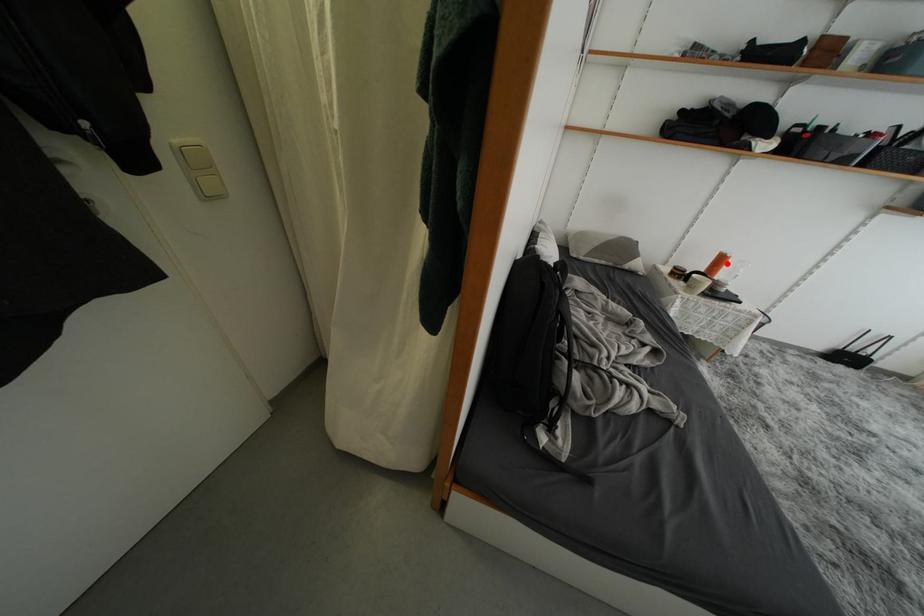
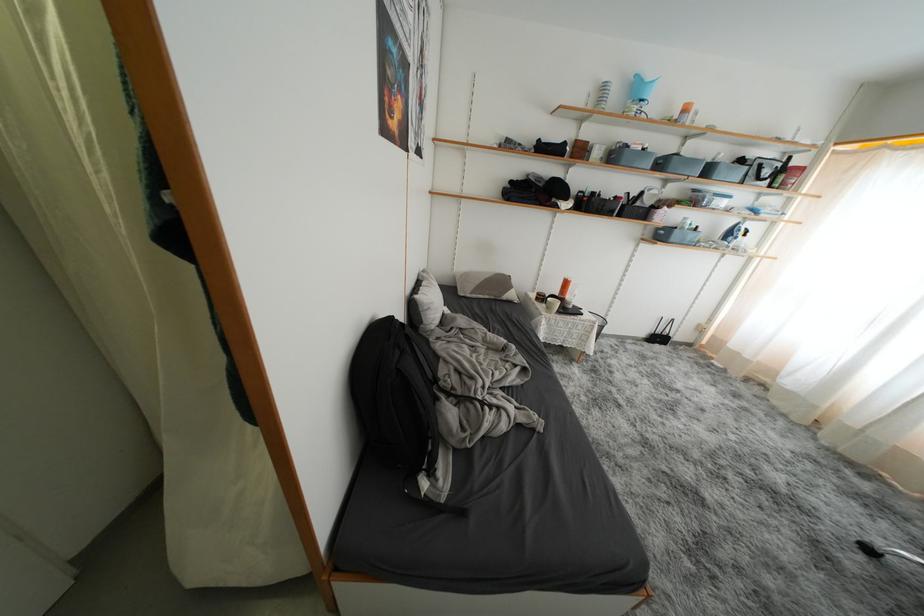
Where in the second image is the point corresponding to the highlighted location from the first image?

(572, 286)